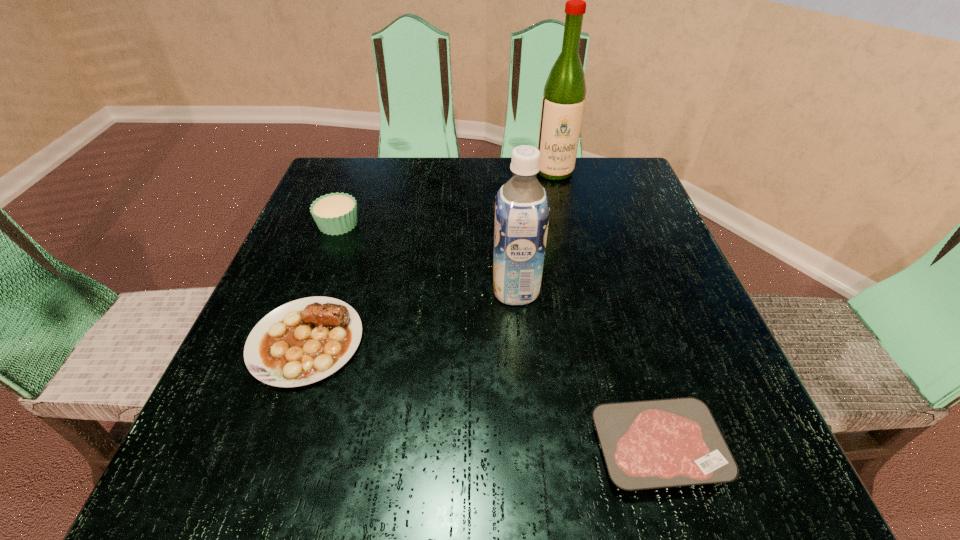
Image resolution: width=960 pixels, height=540 pixels. I want to click on free space in the image that satisfies the following two spatial constraints: 1. on the label of the liquor; 2. on the left side of the right steak, so coord(618,448).

I want to click on free point that satisfies the following two spatial constraints: 1. on the label of the second tallest object; 2. on the right side of the right steak, so click(528, 448).